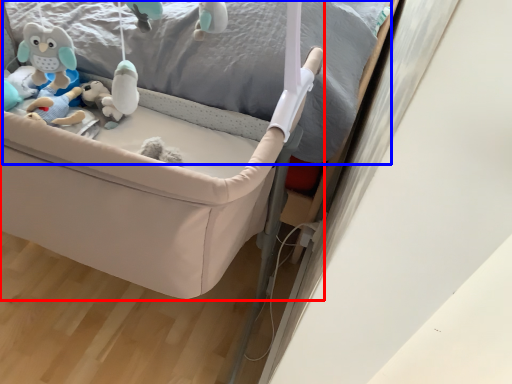
Question: Which of the following is the farthest to the observer, infant bed (highlighted by a red box) or bed frame (highlighted by a blue box)?

Choices:
 (A) infant bed
 (B) bed frame

Answer: (A)